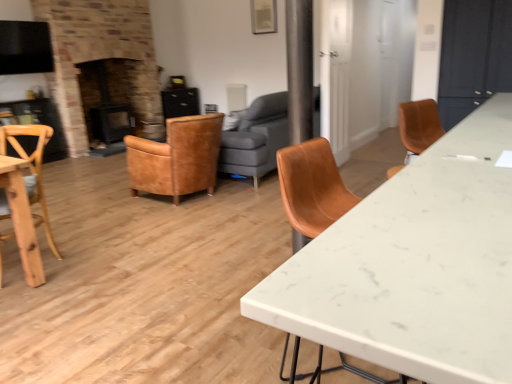
Question: From the image's perspective, is black matte fireplace at left on top of black glossy exhaust hood at upper left?

Choices:
 (A) no
 (B) yes

Answer: (A)

Question: Considering the relative positions of black matte fireplace at left and black glossy exhaust hood at upper left in the image provided, is black matte fireplace at left to the left of black glossy exhaust hood at upper left from the viewer's perspective?

Choices:
 (A) yes
 (B) no

Answer: (B)

Question: From a real-world perspective, is black matte fireplace at left located higher than black glossy exhaust hood at upper left?

Choices:
 (A) no
 (B) yes

Answer: (A)

Question: From a real-world perspective, is black matte fireplace at left below black glossy exhaust hood at upper left?

Choices:
 (A) yes
 (B) no

Answer: (A)

Question: Is black matte fireplace at left turned away from black glossy exhaust hood at upper left?

Choices:
 (A) no
 (B) yes

Answer: (A)

Question: Does black matte fireplace at left touch black glossy exhaust hood at upper left?

Choices:
 (A) no
 (B) yes

Answer: (A)

Question: Is the position of white marble desk at center more distant than that of leather armchair at center, marked as the 1th chair in a back-to-front arrangement?

Choices:
 (A) yes
 (B) no

Answer: (B)

Question: Is white marble desk at center shorter than leather armchair at center, arranged as the 2th chair when viewed from the front?

Choices:
 (A) yes
 (B) no

Answer: (B)

Question: From the image's perspective, is white marble desk at center below leather armchair at center, arranged as the 2th chair when viewed from the front?

Choices:
 (A) no
 (B) yes

Answer: (B)

Question: From a real-world perspective, is white marble desk at center positioned under leather armchair at center, which ranks as the 1th chair in right-to-left order, based on gravity?

Choices:
 (A) yes
 (B) no

Answer: (B)

Question: Does white marble desk at center contain leather armchair at center, arranged as the 2th chair when viewed from the front?

Choices:
 (A) no
 (B) yes

Answer: (A)

Question: Is white marble desk at center aimed at leather armchair at center, which ranks as the 1th chair in right-to-left order?

Choices:
 (A) yes
 (B) no

Answer: (B)

Question: Is leather couch at center directly adjacent to black glossy exhaust hood at upper left?

Choices:
 (A) yes
 (B) no

Answer: (B)